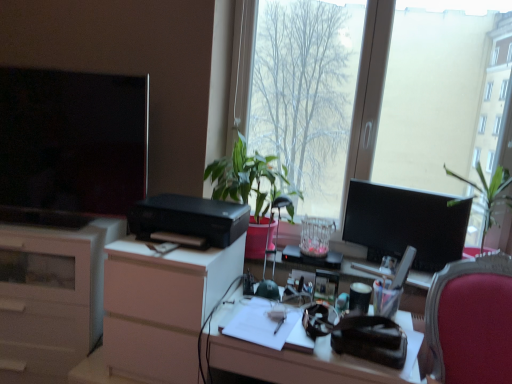
Locate an element on the screen. Image resolution: width=512 pixels, height=384 pixels. matte black television at left, acting as the 1th television starting from the left is located at coordinates (73, 140).

What do you see at coordinates (189, 219) in the screenshot?
I see `black plastic printer at center` at bounding box center [189, 219].

What is the approximate width of green leafy plant at center?

The width of green leafy plant at center is 16.97 inches.

This screenshot has height=384, width=512. I want to click on translucent glass vase at center, so click(x=316, y=236).

Identify the location of white glossy cabinet at left. This screenshot has width=512, height=384. (51, 298).

I want to click on white paper at center, so click(260, 323).

The image size is (512, 384). In order to click on television on the left of white matte dresser at center in this screenshot , I will do `click(73, 140)`.

Based on the photo, from a real-world perspective, is matte black television at left, which is the 2th television from right to left, positioned over white matte dresser at center based on gravity?

Correct, in the physical world, matte black television at left, which is the 2th television from right to left, is higher than white matte dresser at center.

Which object is positioned more to the left, matte black television at left, which is the 2th television from right to left, or white matte dresser at center?

matte black television at left, which is the 2th television from right to left.

Considering the sizes of objects velvet red chair at right and black plastic printer at center in the image provided, who is smaller, velvet red chair at right or black plastic printer at center?

Smaller between the two is black plastic printer at center.

Considering the positions of point (442, 374) and point (215, 209), is point (442, 374) closer or farther from the camera than point (215, 209)?

Point (442, 374) appears to be closer to the viewer than point (215, 209).

Who is taller, velvet red chair at right or black plastic printer at center?

Standing taller between the two is velvet red chair at right.

Locate an element on the screen. Image resolution: width=512 pixels, height=384 pixels. printer located on the left of velvet red chair at right is located at coordinates (189, 219).

From the picture: Is velvet red chair at right in front of or behind translucent glass vase at center in the image?

Clearly, velvet red chair at right is in front of translucent glass vase at center.

Considering the sizes of objects velvet red chair at right and translucent glass vase at center in the image provided, who is shorter, velvet red chair at right or translucent glass vase at center?

With less height is translucent glass vase at center.

From a real-world perspective, which is physically below, velvet red chair at right or translucent glass vase at center?

velvet red chair at right.

Image resolution: width=512 pixels, height=384 pixels. I want to click on glass vase above the velvet red chair at right (from the image's perspective), so click(x=316, y=236).

Is translucent glass vase at center positioned with its back to green leafy plant at center?

No.

From a real-world perspective, which object rests below the other?

In real-world perspective, translucent glass vase at center is lower.

Does translucent glass vase at center have a greater width compared to green leafy plant at center?

No.

Are translucent glass vase at center and green leafy plant at center making contact?

No.

Does point (192, 331) appear closer or farther from the camera than point (137, 180)?

Point (192, 331) is positioned closer to the camera compared to point (137, 180).

Considering the sizes of objects white matte dresser at center and matte black television at left, which is the 2th television from right to left, in the image provided, who is taller, white matte dresser at center or matte black television at left, which is the 2th television from right to left,?

With more height is matte black television at left, which is the 2th television from right to left.

Is white matte dresser at center in front of or behind matte black television at left, which is the 2th television from right to left, in the image?

white matte dresser at center is in front of matte black television at left, which is the 2th television from right to left.

Looking at this image, is white matte dresser at center facing away from matte black television at left, which is the 2th television from right to left?

white matte dresser at center is not turned away from matte black television at left, which is the 2th television from right to left.

Based on the photo, can you confirm if translucent glass vase at center is positioned to the right of white glossy cabinet at left?

Yes, translucent glass vase at center is to the right of white glossy cabinet at left.

Is translucent glass vase at center facing away from white glossy cabinet at left?

No, white glossy cabinet at left is not at the back of translucent glass vase at center.

From the image's perspective, which one is positioned higher, translucent glass vase at center or white glossy cabinet at left?

translucent glass vase at center.

Is translucent glass vase at center completely or partially outside of white glossy cabinet at left?

That's correct, translucent glass vase at center is outside of white glossy cabinet at left.

From the picture: Is green leafy plant at center with transparent glass window at center?

No, green leafy plant at center is not in contact with transparent glass window at center.

Which object is more forward, green leafy plant at center or transparent glass window at center?

transparent glass window at center is in front.

Is green leafy plant at center facing towards transparent glass window at center?

No, green leafy plant at center is not facing towards transparent glass window at center.

Is transparent glass window at center surrounded by green leafy plant at center?

No, transparent glass window at center is not inside green leafy plant at center.

This screenshot has width=512, height=384. I want to click on dresser below the matte black television at left, acting as the 1th television starting from the left (from the image's perspective), so click(x=162, y=306).

Where is `chair to the right of black plastic printer at center`? The height and width of the screenshot is (384, 512). chair to the right of black plastic printer at center is located at coordinates (471, 320).

From the image, which object appears to be farther from matte black monitor at center, arranged as the first television when viewed from the right, matte black television at left, acting as the 1th television starting from the left, or white glossy cabinet at left?

white glossy cabinet at left is positioned further to the anchor matte black monitor at center, arranged as the first television when viewed from the right.

Looking at the image, which one is located further to white matte dresser at center, black plastic printer at center or matte black monitor at center, the second television positioned from the left?

Among the two, matte black monitor at center, the second television positioned from the left, is located further to white matte dresser at center.

Which object lies further to the anchor point translucent glass vase at center, matte black desk at center or transparent glass window at center?

matte black desk at center is positioned further to the anchor translucent glass vase at center.

Based on their spatial positions, is transparent glass window at center or black plastic printer at center closer to matte black television at left, acting as the 1th television starting from the left?

black plastic printer at center lies closer to matte black television at left, acting as the 1th television starting from the left, than the other object.

Based on their spatial positions, is black plastic printer at center or velvet red chair at right closer to matte black desk at center?

velvet red chair at right is closer to matte black desk at center.

Based on their spatial positions, is transparent glass window at center or black plastic printer at center closer to white paper at center?

black plastic printer at center.

When comparing their distances from matte black television at left, acting as the 1th television starting from the left, does white paper at center or white glossy cabinet at left seem closer?

The object closer to matte black television at left, acting as the 1th television starting from the left, is white glossy cabinet at left.

Estimate the real-world distances between objects in this image. Which object is closer to velvet red chair at right, white glossy cabinet at left or green leafy plant at center?

Based on the image, green leafy plant at center appears to be nearer to velvet red chair at right.

This screenshot has width=512, height=384. I want to click on television located between white glossy cabinet at left and black plastic printer at center in the left-right direction, so click(73, 140).

This screenshot has height=384, width=512. What are the coordinates of `window between white glossy cabinet at left and velvet red chair at right in the horizontal direction` in the screenshot? It's located at (415, 97).

You are a GUI agent. You are given a task and a screenshot of the screen. Output one action in this format:
    pyautogui.click(x=<x>, y=<y>)
    Task: Click on the window located between matte black television at left, which is the 2th television from right to left, and matte black monitor at center, the second television positioned from the left, in the left-right direction
    Image resolution: width=512 pixels, height=384 pixels.
    Given the screenshot: What is the action you would take?
    pyautogui.click(x=415, y=97)

Where is `printer between white glossy cabinet at left and matte black monitor at center, arranged as the first television when viewed from the right, in the horizontal direction`? printer between white glossy cabinet at left and matte black monitor at center, arranged as the first television when viewed from the right, in the horizontal direction is located at coordinates (189, 219).